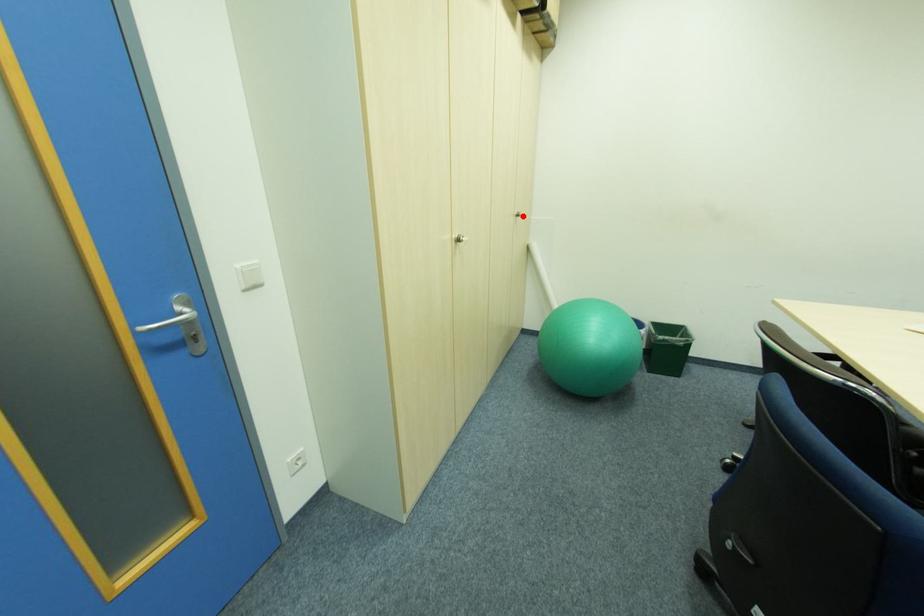
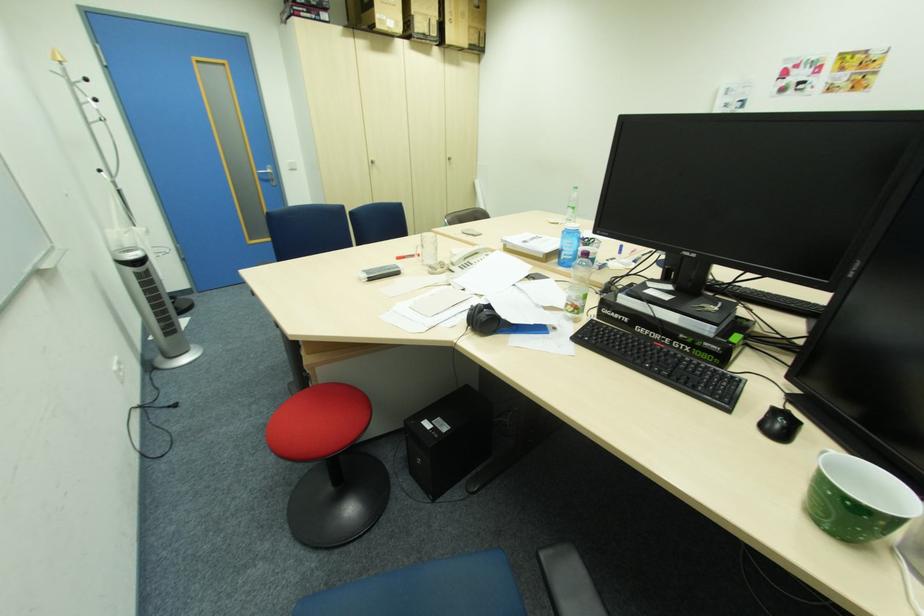
Find the pixel in the second image that matches the highlighted location in the first image.

(456, 159)